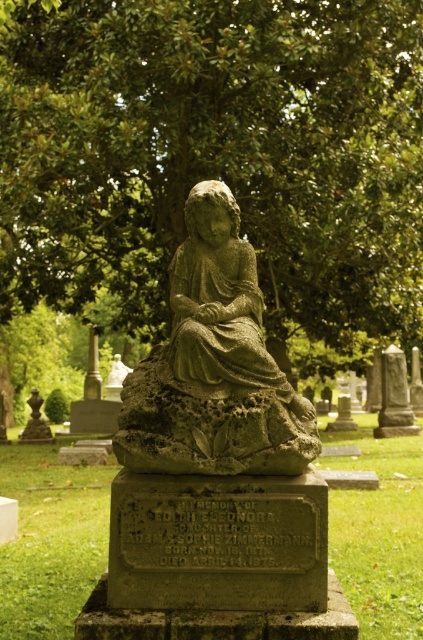
In the cemetery scene, there is a stone statue at center and a smooth gray stone at upper right. From the perspective of someone standing in front of the monument, which object is positioned to the right?

The smooth gray stone at upper right is positioned to the right of the stone statue at center.

You are a gardener who needs to place a new 2.5 meter wide flower bed between the green leafy tree at center and the polished bronze vase at left. Can you fit it there?

The distance between the green leafy tree at center and the polished bronze vase at left is 7.83 meters. Since the flower bed is 2.5 meters wide, there is sufficient space to place it between them as 7.83 meters is greater than 2.5 meters.